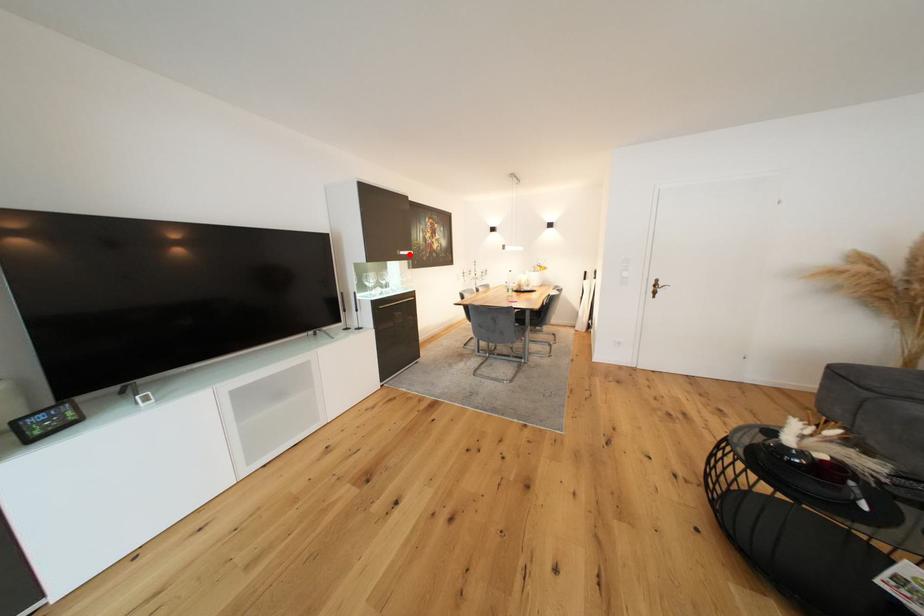
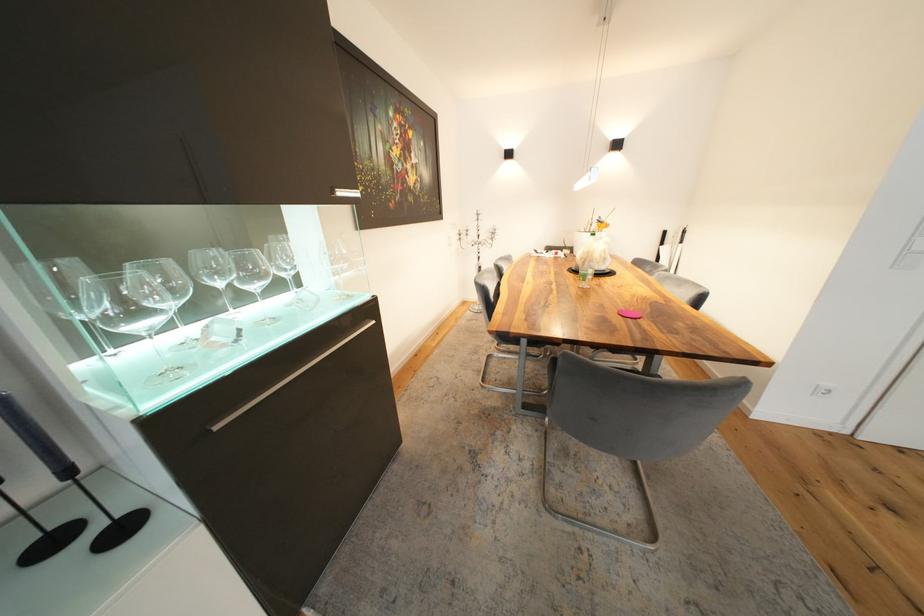
In the second image, find the point that corresponds to the highlighted location in the first image.

(348, 195)